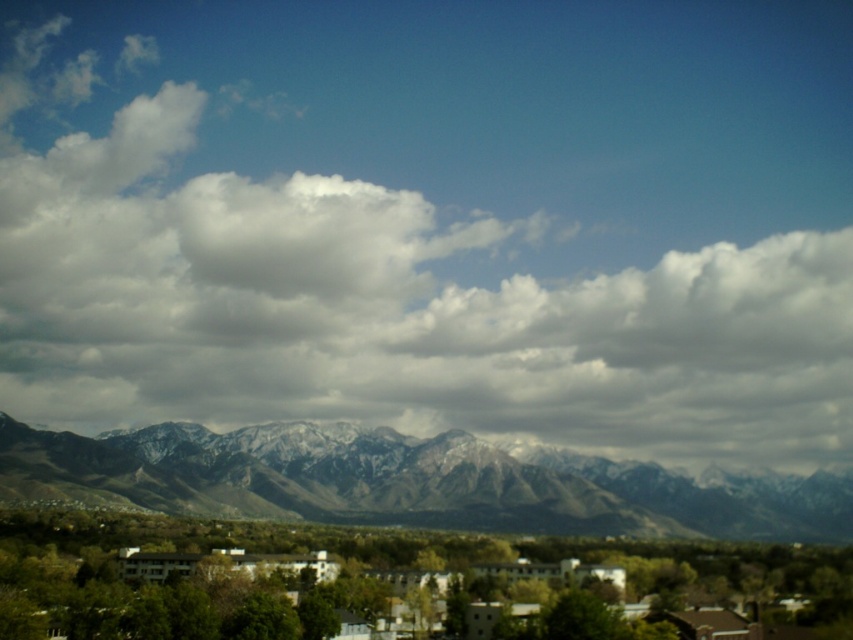
You are a drone operator planning a flight path from the green matte buildings at center to the snowy rock mountain range at center. Which direction should you fly to reach the mountain range from the buildings?

The green matte buildings at center are to the left of the snowy rock mountain range at center, so you should fly to the right to reach the mountain range from the buildings.

You are an astronomer observing the sky from the valley in the image. You notice a white fluffy cloud at upper center. What are its coordinates?

The white fluffy cloud at upper center is located at coordinates point [434,221].